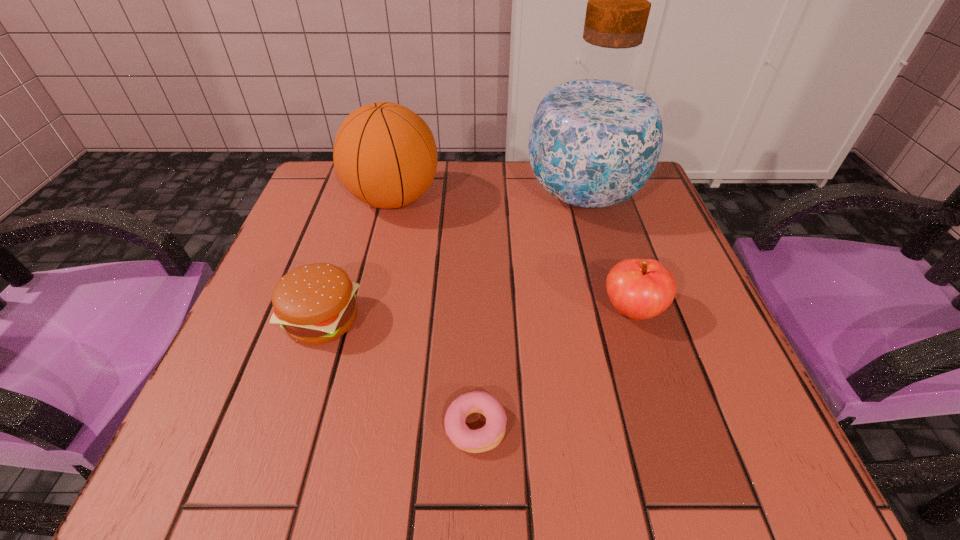
This screenshot has width=960, height=540. In the image, there is a desktop. In order to click on vacant area at the far edge in this screenshot , I will do `click(462, 210)`.

This screenshot has height=540, width=960. I want to click on free space at the near edge, so click(644, 472).

Image resolution: width=960 pixels, height=540 pixels. In the image, there is a desktop. Find the location of `free space at the left edge`. free space at the left edge is located at coordinates (279, 362).

Locate an element on the screen. free space at the right edge is located at coordinates (697, 373).

Identify the location of blank space at the near left corner. This screenshot has height=540, width=960. (199, 431).

Locate an element on the screen. This screenshot has width=960, height=540. vacant space at the far right corner of the desktop is located at coordinates (664, 213).

Where is `vacant area at the near right corner of the desktop`? Image resolution: width=960 pixels, height=540 pixels. vacant area at the near right corner of the desktop is located at coordinates (738, 445).

Image resolution: width=960 pixels, height=540 pixels. Identify the location of unoccupied area between the fourth shortest object and the third object from left to right. (435, 313).

This screenshot has width=960, height=540. Find the location of `free space that is in between the basketball and the apple`. free space that is in between the basketball and the apple is located at coordinates point(513,255).

Locate an element on the screen. free space between the second tallest object and the doughnut is located at coordinates (435, 313).